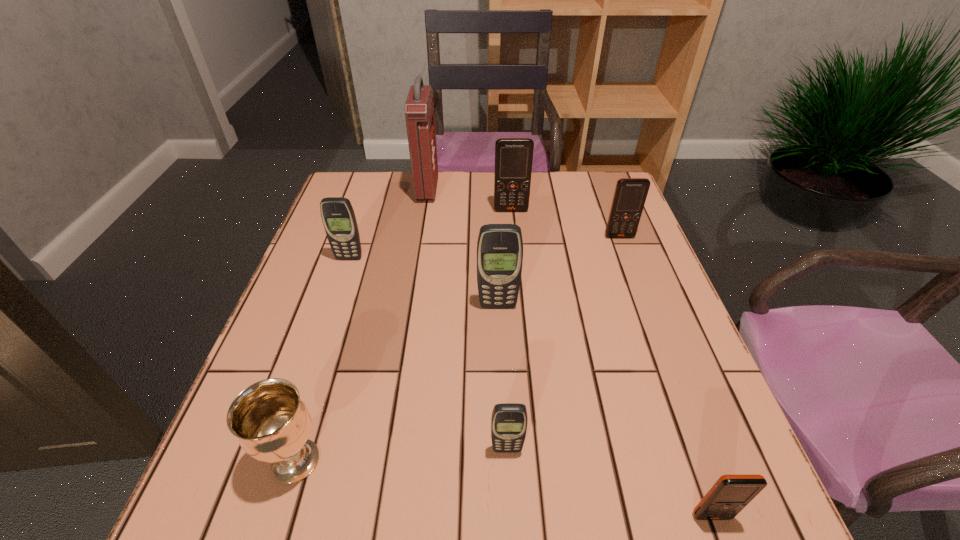
Locate an element on the screen. Image resolution: width=960 pixels, height=540 pixels. free region at the far edge of the desktop is located at coordinates [413, 187].

In the image, there is a desktop. Identify the location of vacant space at the near edge. This screenshot has width=960, height=540. (343, 503).

I want to click on vacant space at the left edge of the desktop, so click(x=310, y=322).

Where is `free space at the far right corner of the desktop`? free space at the far right corner of the desktop is located at coordinates (573, 185).

The image size is (960, 540). Identify the location of vacant region at the near right corner of the desktop. (667, 521).

Where is `vacant space in between the farthest object and the chalice`? This screenshot has height=540, width=960. vacant space in between the farthest object and the chalice is located at coordinates (362, 325).

Find the location of a particular element. The width and height of the screenshot is (960, 540). vacant space in between the nearest cellular telephone and the chalice is located at coordinates 504,488.

Where is `free space between the nearest cellular telephone and the third farthest object`? free space between the nearest cellular telephone and the third farthest object is located at coordinates (665, 376).

Where is `vacant area that lies between the third object from left to right and the chalice`? The width and height of the screenshot is (960, 540). vacant area that lies between the third object from left to right and the chalice is located at coordinates (362, 325).

This screenshot has height=540, width=960. I want to click on blank region between the third object from left to right and the second nearest cellular telephone, so click(x=468, y=319).